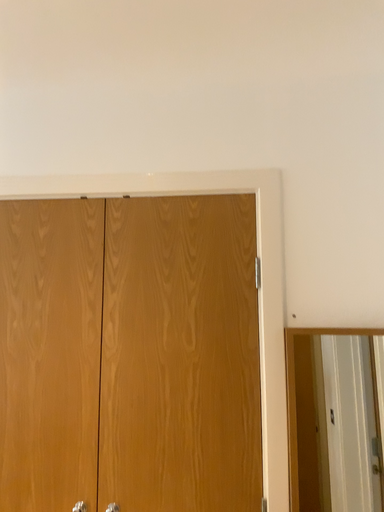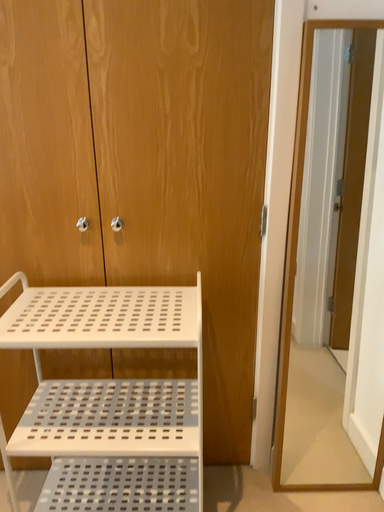
Question: How did the camera likely rotate when shooting the video?

Choices:
 (A) rotated right
 (B) rotated left

Answer: (A)